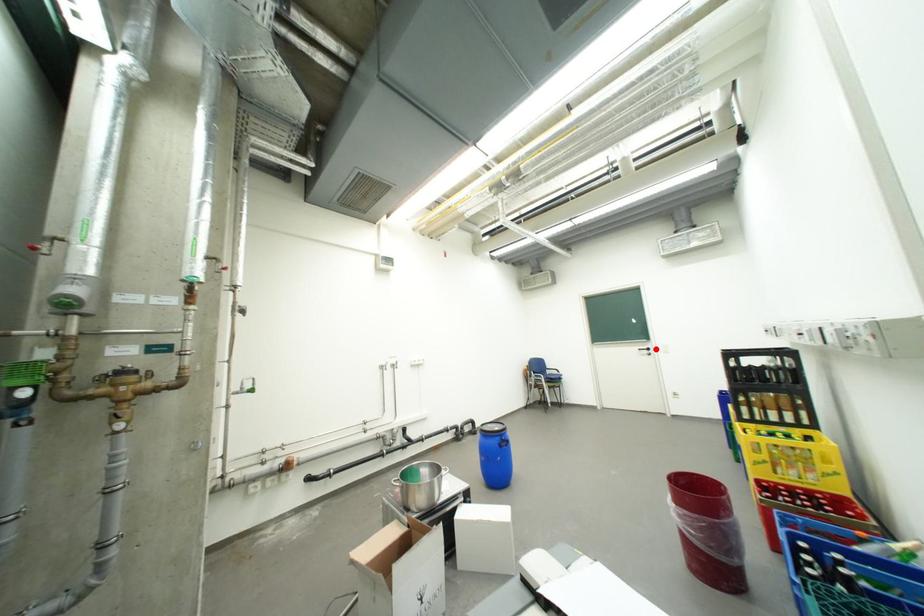
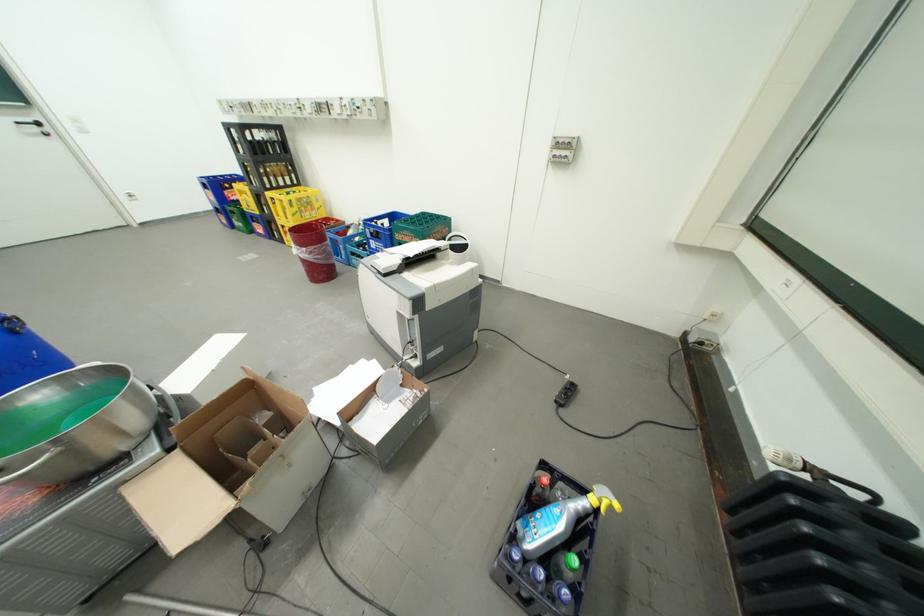
Question: I am providing you with two images of the same scene from different viewpoints. Given a red point in image1, look at the same physical point in image2. Is it:

Choices:
 (A) Closer to the viewpoint
 (B) Farther from the viewpoint

Answer: (B)